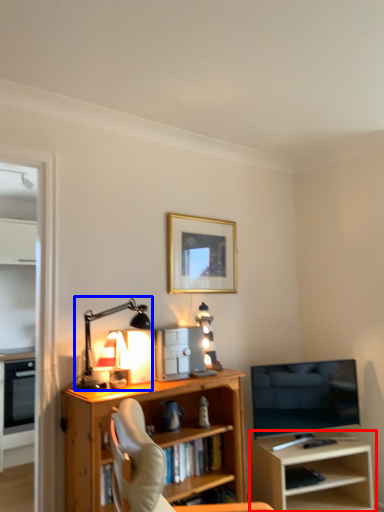
Question: Which point is further to the camera, shelf (highlighted by a red box) or table lamp (highlighted by a blue box)?

Choices:
 (A) shelf
 (B) table lamp

Answer: (A)